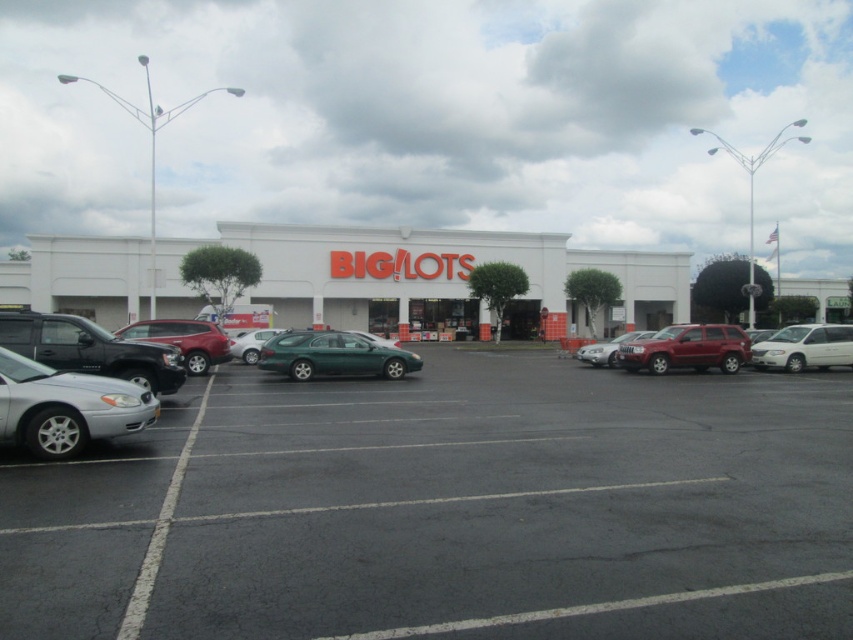
You are a delivery person trying to park your van in the parking lot of the Big Lots store. You see a green matte station wagon at center and a green matte sedan at center. Which vehicle should you choose to park next to if you need more vertical space for your van?

The green matte station wagon at center is much taller than the green matte sedan at center, so you should park next to the green matte sedan at center to have more vertical space for your van.